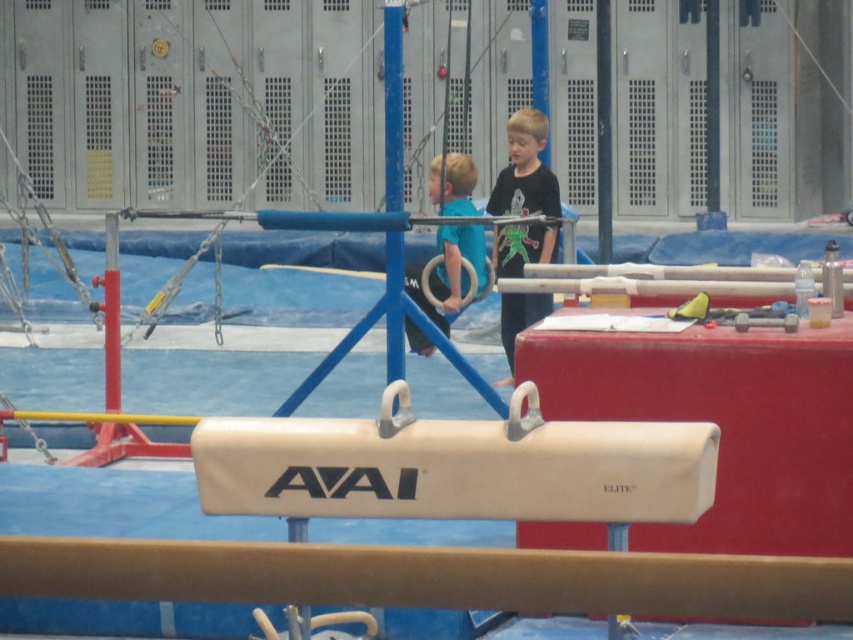
You are a gymnast standing at the point labeled point [383,19]. You need to move to the pommel horse in the foreground. Which direction should you move relative to the point labeled point [457,164]?

Since point [457,164] is closer to the viewer than point [383,19], moving towards the pommel horse would require moving in the direction of point [457,164].

Consider the image. You are a gymnast trying to decide where to place your equipment bag. You need to choose between placing it next to the beige rubber pommel horse at center or the blue metallic pole at center. Which object is bigger and thus might offer more space for placing your bag?

The beige rubber pommel horse at center has a larger size compared to the blue metallic pole at center, so it might provide more space for placing your equipment bag.

Looking at this image, you are standing at the point labeled point (579, 563) and want to move to the pommel horse in the foreground. Is the point labeled point (439, 497) in your way?

Point (439, 497) is behind point (579, 563), so it is not in the way of moving to the pommel horse in the foreground.